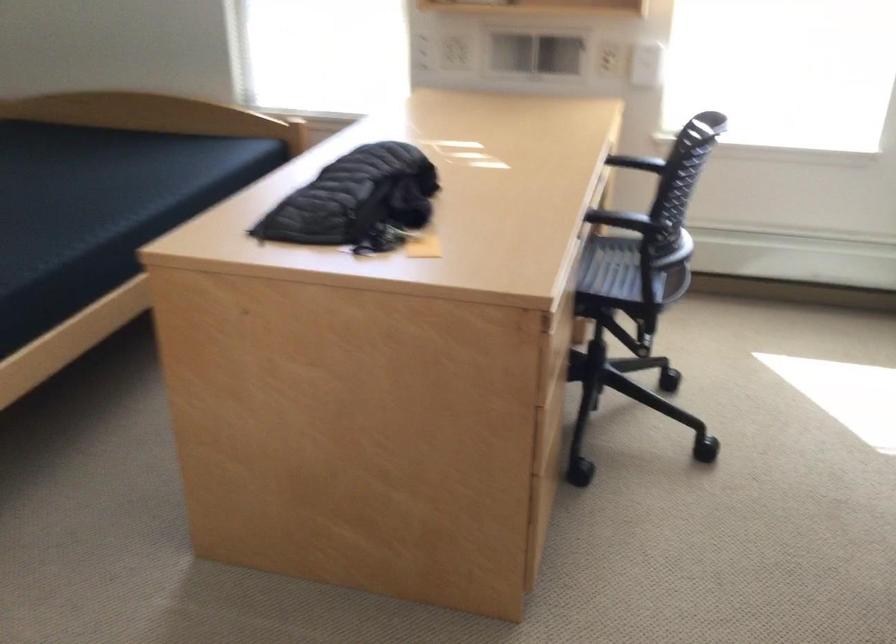
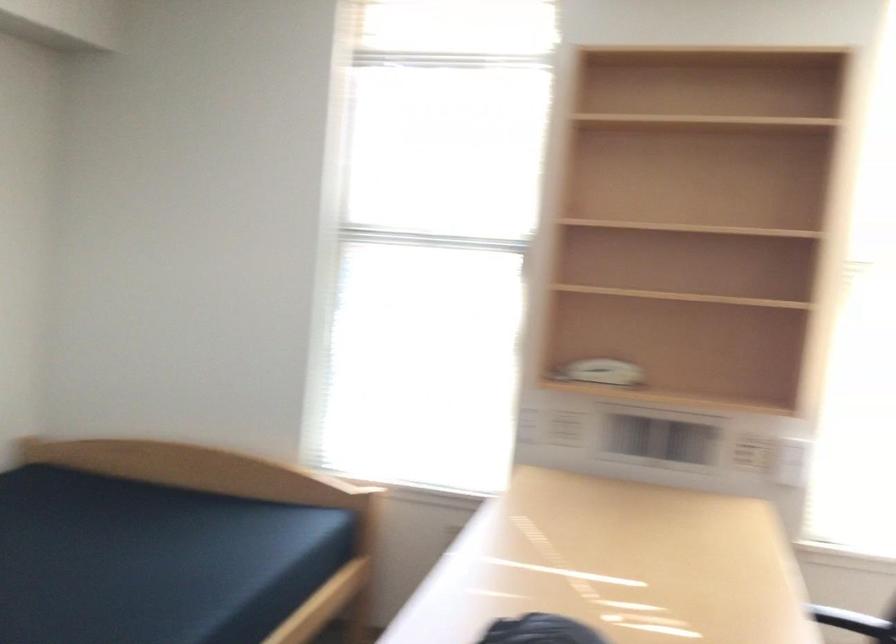
Question: Based on the continuous images, in which direction is the camera rotating? Reply with the corresponding letter.

Choices:
 (A) Left
 (B) Right
 (C) Up
 (D) Down

Answer: (C)